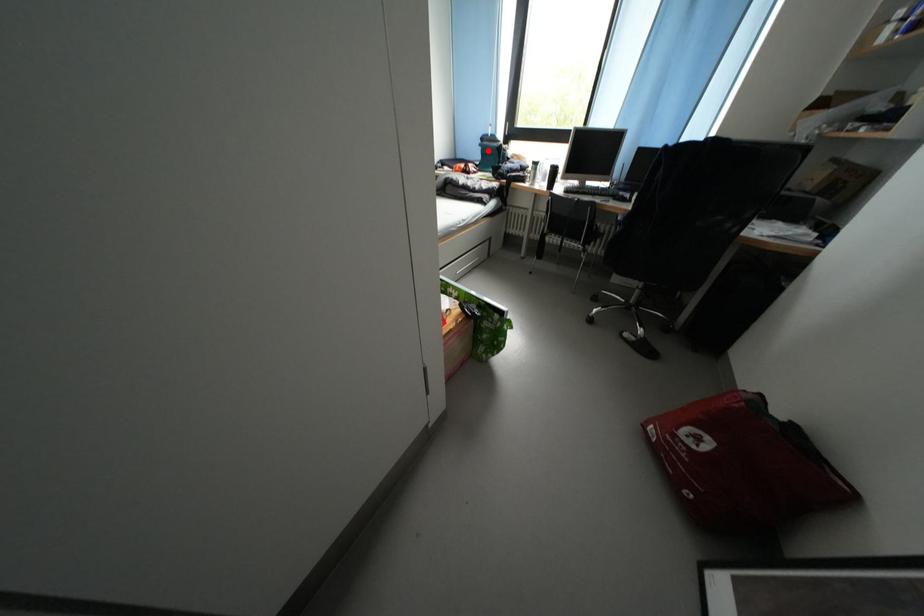
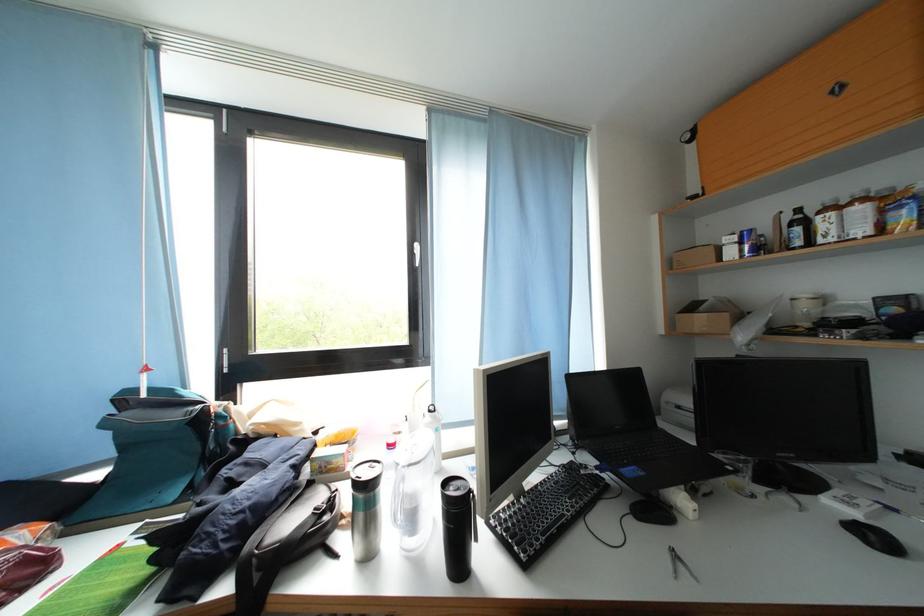
In the second image, find the point that corresponds to the highlighted location in the first image.

(114, 429)